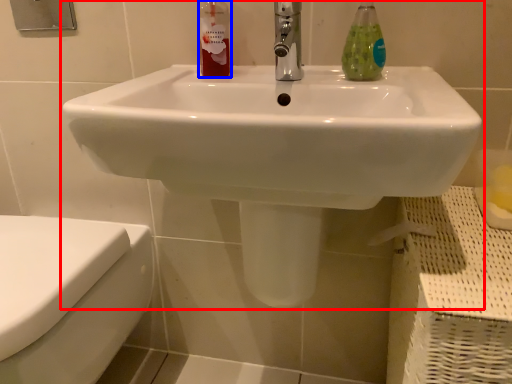
Question: Which object is closer to the camera taking this photo, sink (highlighted by a red box) or cleaning product (highlighted by a blue box)?

Choices:
 (A) sink
 (B) cleaning product

Answer: (A)